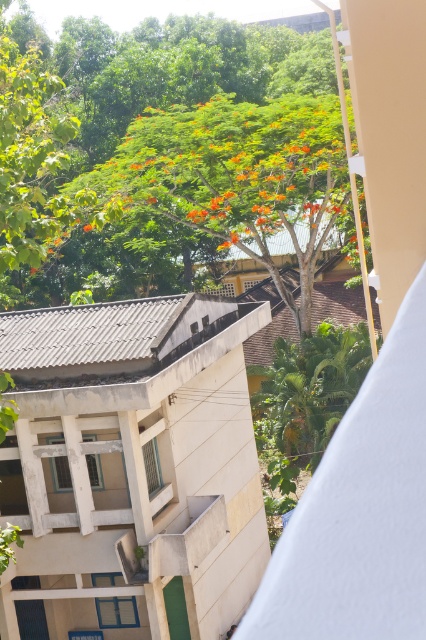
Who is higher up, white concrete balcony at center or green leafy tree at upper center?

green leafy tree at upper center is above.

Is point (42, 326) less distant than point (215, 157)?

That is True.

Find the location of a particular element. white concrete balcony at center is located at coordinates (132, 468).